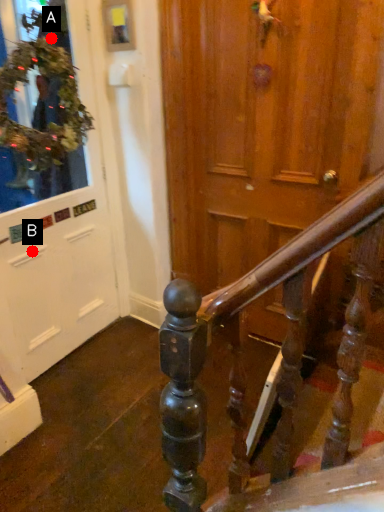
Question: Two points are circled on the image, labeled by A and B beside each circle. Which point is closer to the camera?

Choices:
 (A) A is closer
 (B) B is closer

Answer: (B)